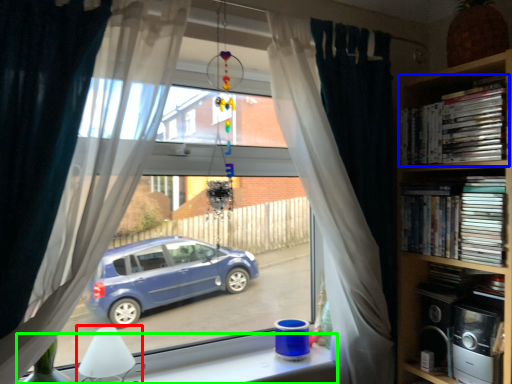
Question: Which object is positioned farthest from lamp (highlighted by a red box)? Select from book (highlighted by a blue box) and window (highlighted by a green box).

Choices:
 (A) book
 (B) window

Answer: (A)